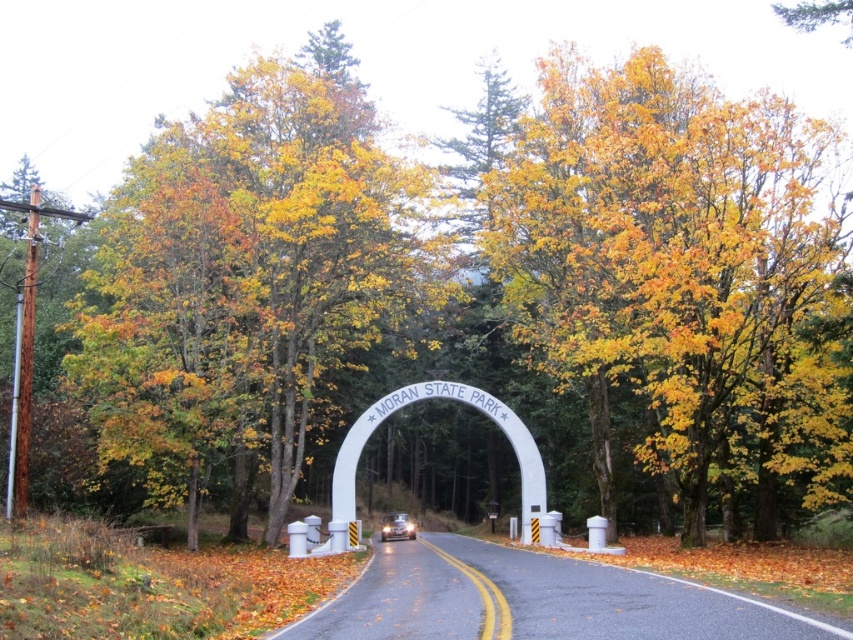
You are driving a metallic silver car at center and want to enter Moran State Park through the white concrete archway at center. Can you safely pass under the archway without hitting it?

The white concrete archway at center is located above the metallic silver car at center, so yes, the car can safely pass under the archway without hitting it as there is sufficient vertical clearance.

You are driving a metallic silver car at center towards the entrance of Moran State Park. The entrance is marked by a white concrete archway at center. Before entering, you need to ensure your car can pass through the archway. Can your car fit through the archway based on their widths?

The white concrete archway at center might be wider than metallic silver car at center, so there is a possibility that the metallic silver car at center can fit through the archway. However, the exact width comparison is uncertain based on the provided information.